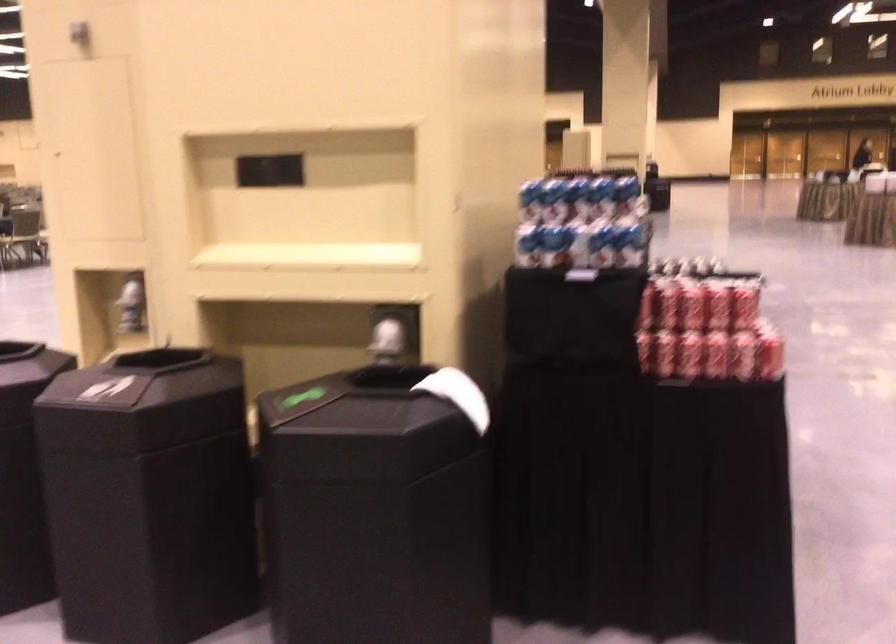
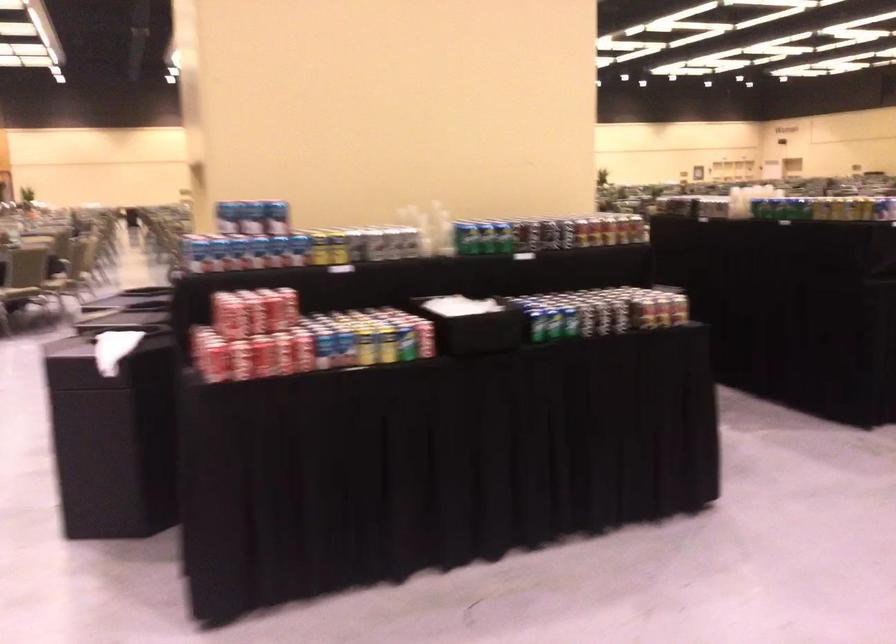
In the second image, find the point that corresponds to point 785,348 in the first image.

(240, 360)